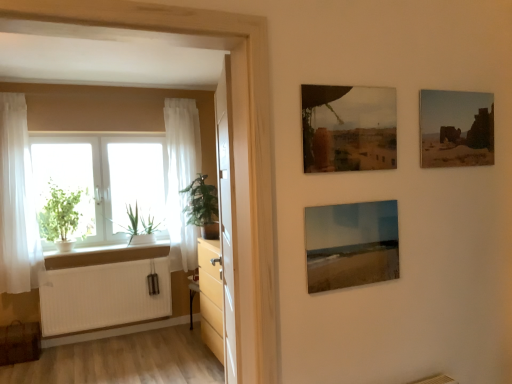
Question: Is green leafy plant at left, placed as the second houseplant when sorted from left to right, spatially inside white ribbed radiator at lower left, or outside of it?

Choices:
 (A) outside
 (B) inside

Answer: (A)

Question: From a real-world perspective, is green leafy plant at left, marked as the first houseplant in a right-to-left arrangement, physically located above or below white ribbed radiator at lower left?

Choices:
 (A) above
 (B) below

Answer: (A)

Question: Which of these objects is positioned closest to the white sheer curtain at left, the second curtain when ordered from front to back?

Choices:
 (A) white wood window sill at lower left
 (B) white ribbed radiator at lower left
 (C) white sheer curtain at left, which ranks as the 2th curtain in back-to-front order
 (D) green leafy plant at left, marked as the first houseplant in a right-to-left arrangement
 (E) green leafy plant at left

Answer: (E)

Question: Considering the real-world distances, which object is farthest from the white sheer curtain at left, the second curtain when ordered from front to back?

Choices:
 (A) green leafy plant at left
 (B) white ribbed radiator at lower left
 (C) white sheer curtain at left, acting as the 2th curtain starting from the right
 (D) white glass window at left
 (E) green leafy plant at left, placed as the second houseplant when sorted from left to right

Answer: (C)